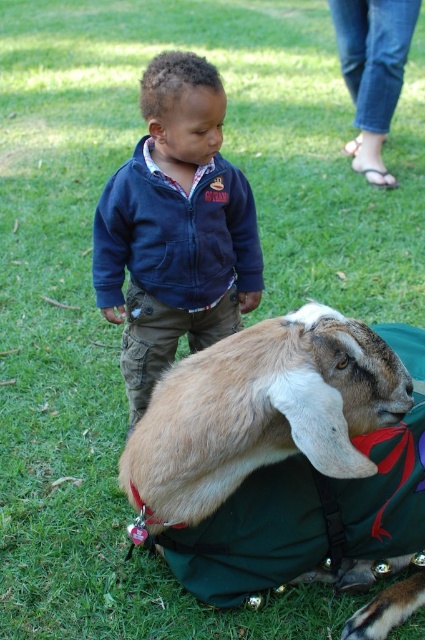
Question: Which of the following is the closest to the observer?

Choices:
 (A) [x=161, y=234]
 (B) [x=382, y=512]

Answer: (B)

Question: Can you confirm if light brown fur at center is positioned to the left of navy blue fleece jacket at center?

Choices:
 (A) no
 (B) yes

Answer: (A)

Question: Considering the relative positions of light brown fur at center and navy blue fleece jacket at center in the image provided, where is light brown fur at center located with respect to navy blue fleece jacket at center?

Choices:
 (A) right
 (B) left

Answer: (A)

Question: Is light brown fur at center positioned in front of navy blue fleece jacket at center?

Choices:
 (A) yes
 (B) no

Answer: (A)